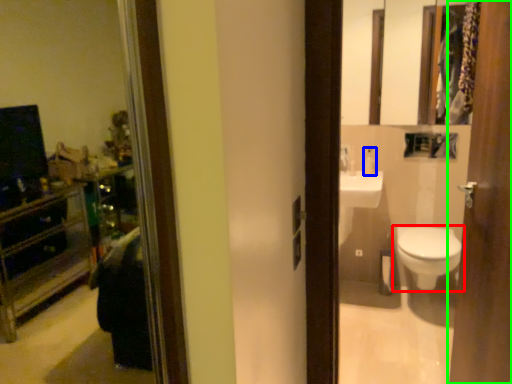
Question: Based on their relative distances, which object is nearer to toilet (highlighted by a red box)? Choose from toiletry (highlighted by a blue box) and door (highlighted by a green box).

Choices:
 (A) toiletry
 (B) door

Answer: (A)